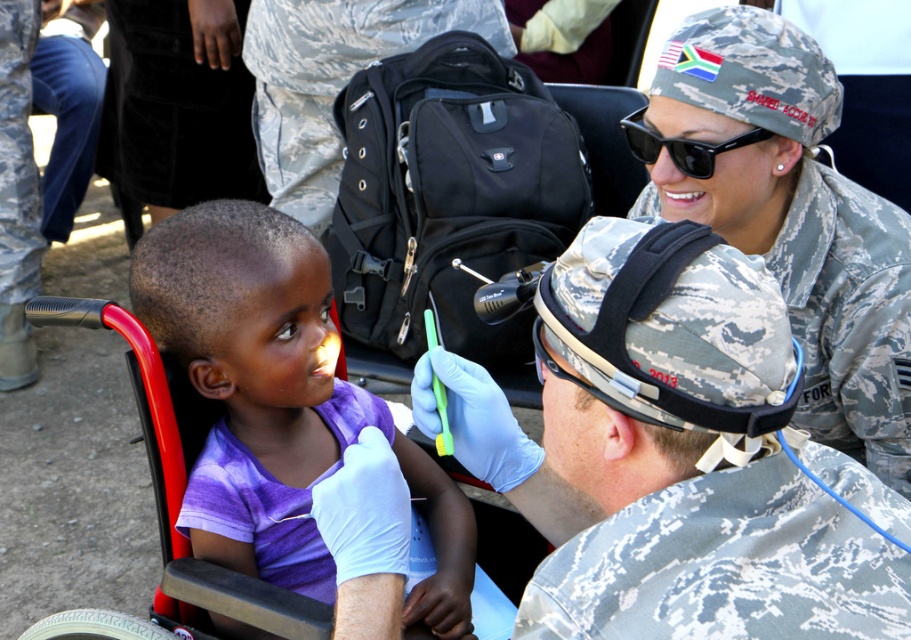
Question: Which point appears farthest from the camera in this image?

Choices:
 (A) (398, 588)
 (B) (678, 113)
 (C) (764, 374)

Answer: (B)

Question: Estimate the real-world distances between objects in this image. Which object is closer to the camouflage uniform at upper right?

Choices:
 (A) purple cotton shirt at center
 (B) black matte sunglasses at upper center

Answer: (B)

Question: Does camouflage fabric helmet at center have a larger size compared to purple cotton shirt at center?

Choices:
 (A) no
 (B) yes

Answer: (A)

Question: Does camouflage fabric helmet at center appear on the right side of purple cotton shirt at center?

Choices:
 (A) no
 (B) yes

Answer: (B)

Question: Which of the following is the closest to the observer?

Choices:
 (A) (779, 180)
 (B) (600, 218)
 (C) (686, 152)

Answer: (B)

Question: From the image, what is the correct spatial relationship of purple cotton shirt at center in relation to camouflage uniform at upper right?

Choices:
 (A) below
 (B) above

Answer: (A)